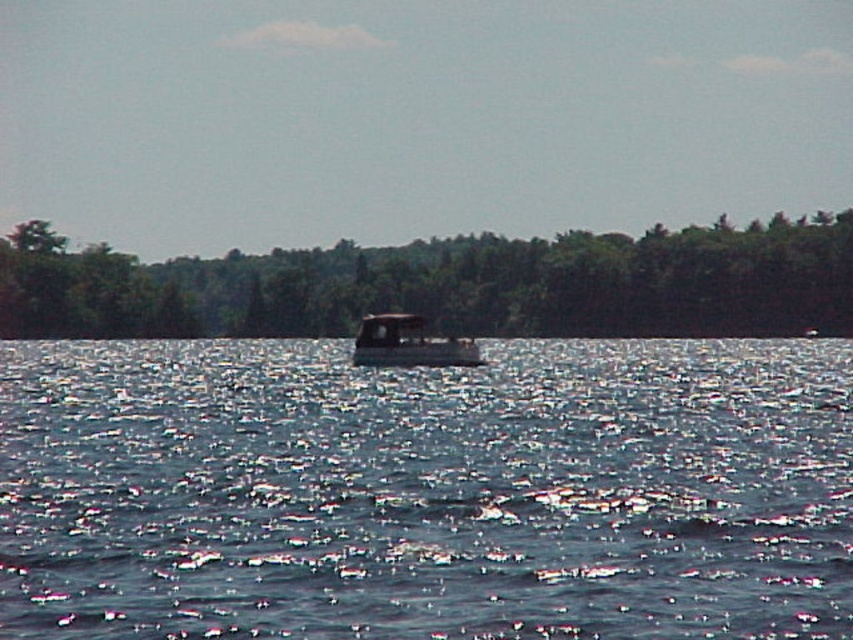
Question: Which point is closer to the camera taking this photo?

Choices:
 (A) (834, 268)
 (B) (409, 387)
 (C) (384, 340)

Answer: (B)

Question: Can you confirm if green matte tree at center is positioned below metallic gray boat at center?

Choices:
 (A) no
 (B) yes

Answer: (A)

Question: Based on their relative distances, which object is nearer to the metallic gray boat at center?

Choices:
 (A) blue water at center
 (B) green matte tree at center

Answer: (A)

Question: Which of the following is the farthest from the observer?

Choices:
 (A) blue water at center
 (B) green matte tree at center
 (C) metallic gray boat at center

Answer: (B)

Question: Is green matte tree at center to the left of metallic gray boat at center from the viewer's perspective?

Choices:
 (A) no
 (B) yes

Answer: (A)

Question: In this image, where is blue water at center located relative to metallic gray boat at center?

Choices:
 (A) above
 (B) below

Answer: (B)